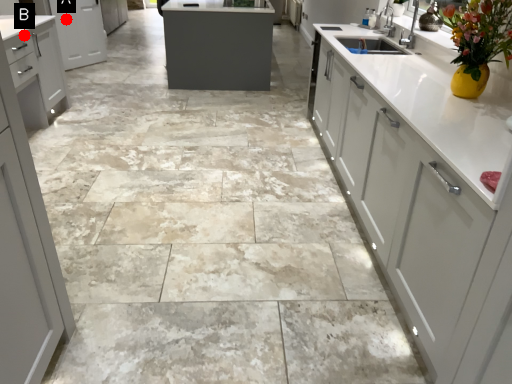
Question: Two points are circled on the image, labeled by A and B beside each circle. Which point is closer to the camera taking this photo?

Choices:
 (A) A is closer
 (B) B is closer

Answer: (B)